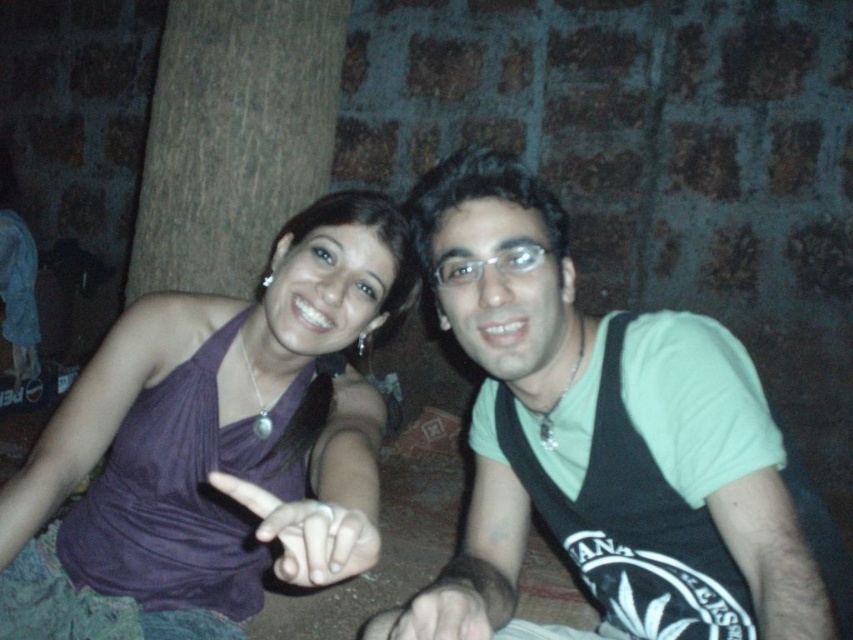
Question: Does purple fabric hand at center appear under smooth skin hand at center?

Choices:
 (A) no
 (B) yes

Answer: (A)

Question: Which point appears farthest from the camera in this image?

Choices:
 (A) click(305, 339)
 (B) click(393, 627)

Answer: (A)

Question: Can you confirm if green matte shirt at center is positioned to the right of purple satin dress at center?

Choices:
 (A) no
 (B) yes

Answer: (B)

Question: Estimate the real-world distances between objects in this image. Which object is farther from the smooth skin hand at center?

Choices:
 (A) green matte shirt at center
 (B) purple satin dress at center
 (C) purple fabric hand at center
 (D) brown wood tree at upper left

Answer: (D)

Question: Does green matte shirt at center appear over brown wood tree at upper left?

Choices:
 (A) yes
 (B) no

Answer: (B)

Question: Which point appears closest to the camera in this image?

Choices:
 (A) (366, 461)
 (B) (466, 627)
 (C) (20, 492)

Answer: (B)